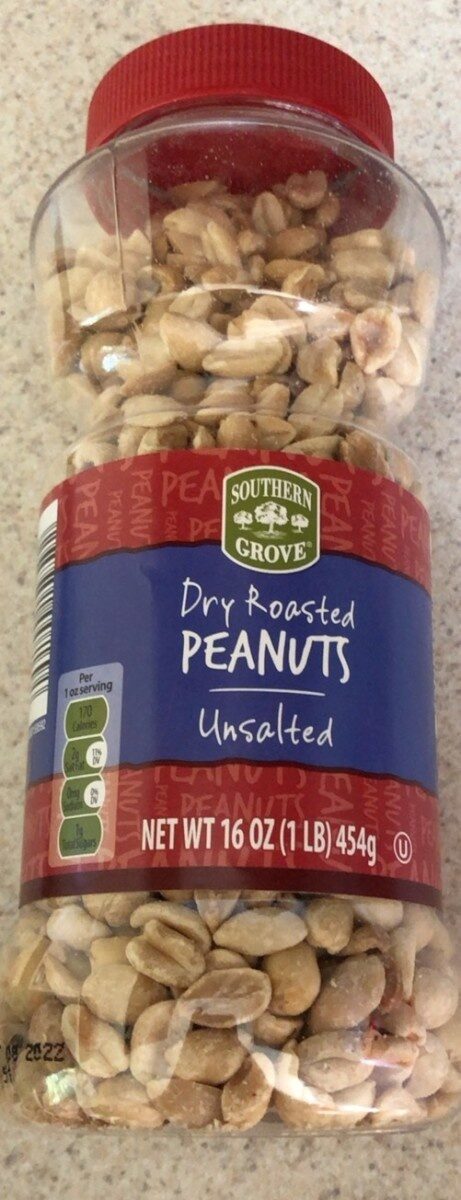
The height and width of the screenshot is (1200, 461). I want to click on granite countertop, so click(26, 385).